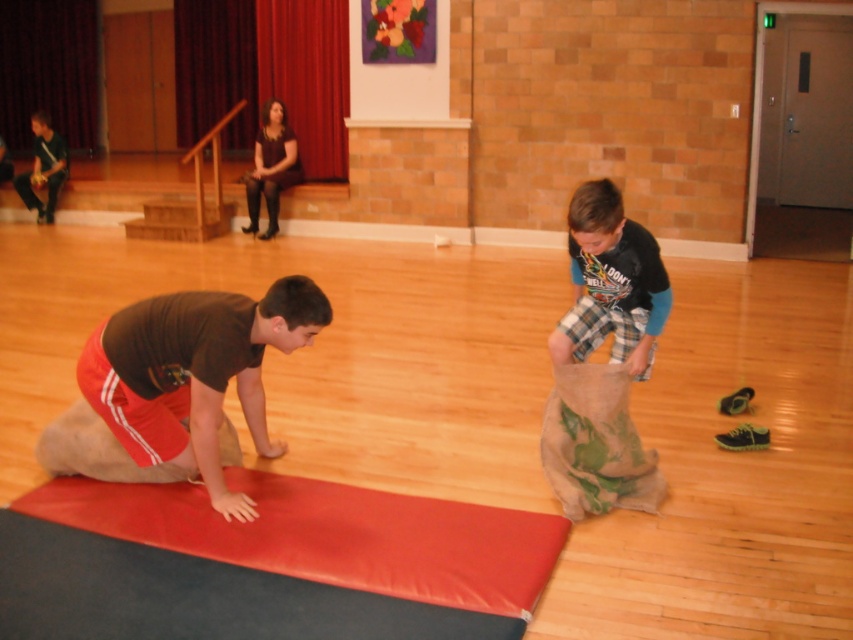
Question: Is matte brown shorts at lower left smaller than matte black guitar at left?

Choices:
 (A) yes
 (B) no

Answer: (B)

Question: Can you confirm if matte brown shorts at lower left is smaller than matte black guitar at left?

Choices:
 (A) no
 (B) yes

Answer: (A)

Question: Which of these objects is positioned farthest from the matte brown shorts at lower left?

Choices:
 (A) matte black guitar at left
 (B) plaid fabric pants at right

Answer: (A)

Question: Which of these objects is positioned farthest from the matte black guitar at left?

Choices:
 (A) matte brown shorts at lower left
 (B) plaid fabric pants at right

Answer: (B)

Question: Can you confirm if matte brown shorts at lower left is positioned above plaid fabric pants at right?

Choices:
 (A) yes
 (B) no

Answer: (B)

Question: Estimate the real-world distances between objects in this image. Which object is farther from the plaid fabric pants at right?

Choices:
 (A) matte black guitar at left
 (B) matte brown shorts at lower left

Answer: (A)